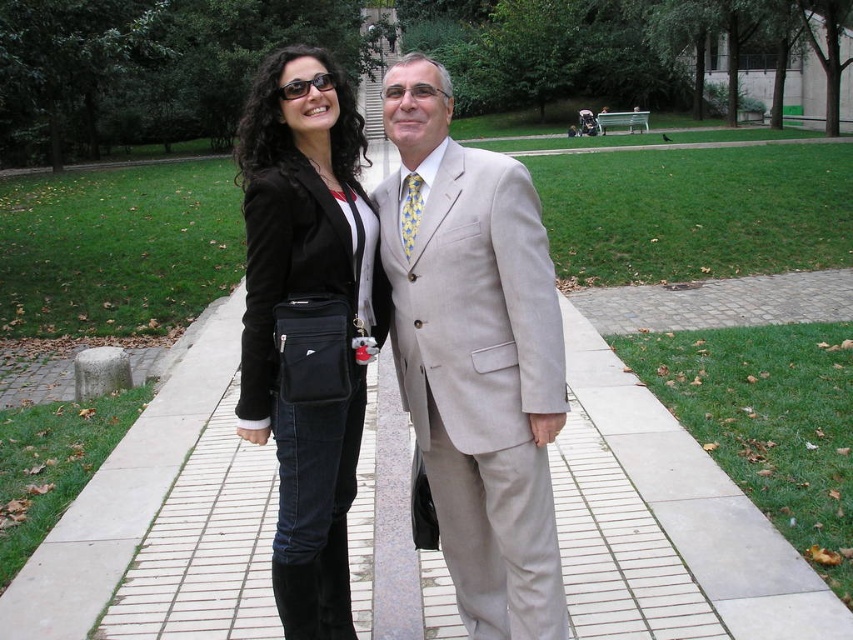
Is light beige suit at center behind black leather jacket at center?

No, light beige suit at center is closer to the viewer.

Can you confirm if light beige suit at center is thinner than black leather jacket at center?

Indeed, light beige suit at center has a lesser width compared to black leather jacket at center.

Where is `light beige suit at center`? The image size is (853, 640). light beige suit at center is located at coordinates (474, 355).

Locate an element on the screen. The width and height of the screenshot is (853, 640). light beige suit at center is located at coordinates (474, 355).